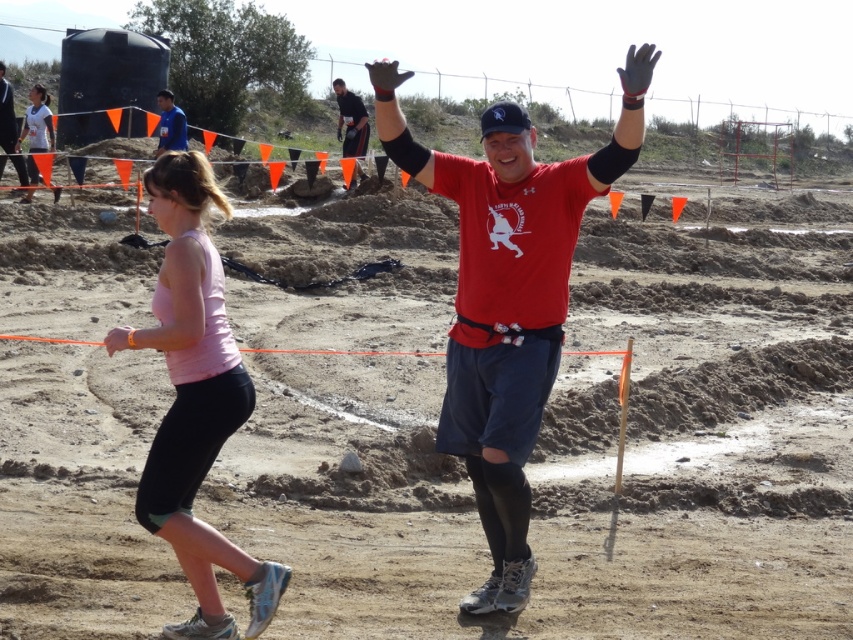
You are a photographer at the race event. You want to take a photo that includes both the pink fabric tank top at left and the matte blue shirt at upper left. Which one should you focus on to ensure both are in sharp focus?

You should focus on the pink fabric tank top at left because it is closer to the viewer than the matte blue shirt at upper left, ensuring both will be in focus when focusing on the closer object.

You are a photographer standing at the origin point of the coordinate system. You want to take a photo of the matte red shirt at center. What are the coordinates where you should aim your camera?

The coordinates to aim the camera are at point (x=508, y=296) to capture the matte red shirt at center.